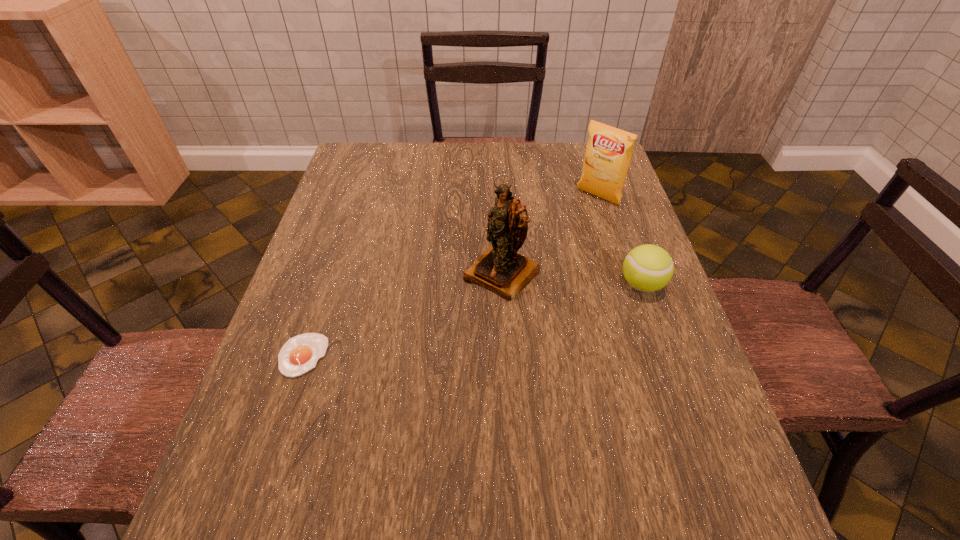
Identify the location of free space located 0.190m on the front of the crisp (potato chip) with the logo. The width and height of the screenshot is (960, 540). (552, 239).

Where is `blank area located 0.200m on the front of the crisp (potato chip) with the logo`? The height and width of the screenshot is (540, 960). blank area located 0.200m on the front of the crisp (potato chip) with the logo is located at coordinates (550, 240).

In order to click on free location located 0.320m on the front-facing side of the third object from right to left in this screenshot , I will do `click(383, 393)`.

At what (x,y) coordinates should I click in order to perform the action: click on free location located on the front-facing side of the third object from right to left. Please return your answer as a coordinate pair (x, y). Looking at the image, I should click on (464, 311).

Where is `vacant space located 0.380m on the front-facing side of the third object from right to left`? The image size is (960, 540). vacant space located 0.380m on the front-facing side of the third object from right to left is located at coordinates (360, 416).

What are the coordinates of `object located in the left edge section of the desktop` in the screenshot? It's located at (299, 354).

Where is `tennis ball located in the right edge section of the desktop`? Image resolution: width=960 pixels, height=540 pixels. tennis ball located in the right edge section of the desktop is located at coordinates (647, 268).

Where is `crisp (potato chip) located at the right edge`? This screenshot has height=540, width=960. crisp (potato chip) located at the right edge is located at coordinates (609, 150).

At what (x,y) coordinates should I click in order to perform the action: click on free space at the far edge of the desktop. Please return your answer as a coordinate pair (x, y). The image size is (960, 540). Looking at the image, I should click on (484, 173).

This screenshot has width=960, height=540. In the image, there is a desktop. Identify the location of vacant space at the near edge. (335, 469).